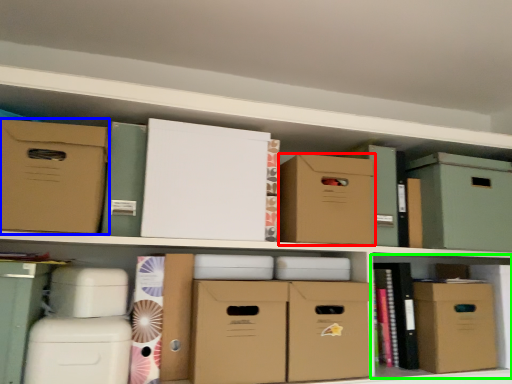
Question: Which object is the closest to the cardboard box (highlighted by a red box)? Choose among these: cardboard box (highlighted by a blue box) or cabinet (highlighted by a green box).

Choices:
 (A) cardboard box
 (B) cabinet

Answer: (B)